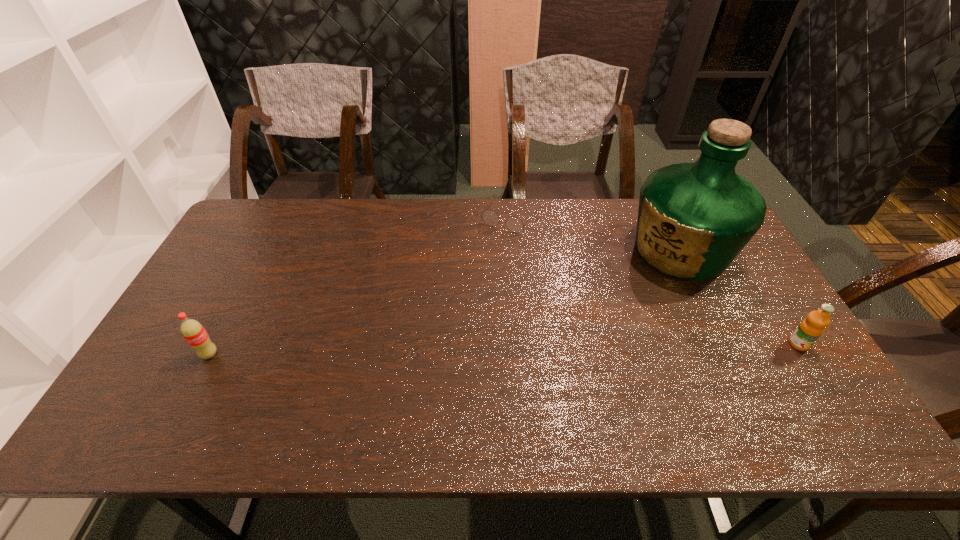
Locate an element on the screen. This screenshot has width=960, height=540. free space on the desktop that is between the leftmost object and the orange juice and is positioned on the temples of the second object from left to right is located at coordinates (423, 350).

Locate an element on the screen. vacant spot on the desktop that is between the leftmost object and the orange juice and is positioned on the label side of the tallest object is located at coordinates (533, 349).